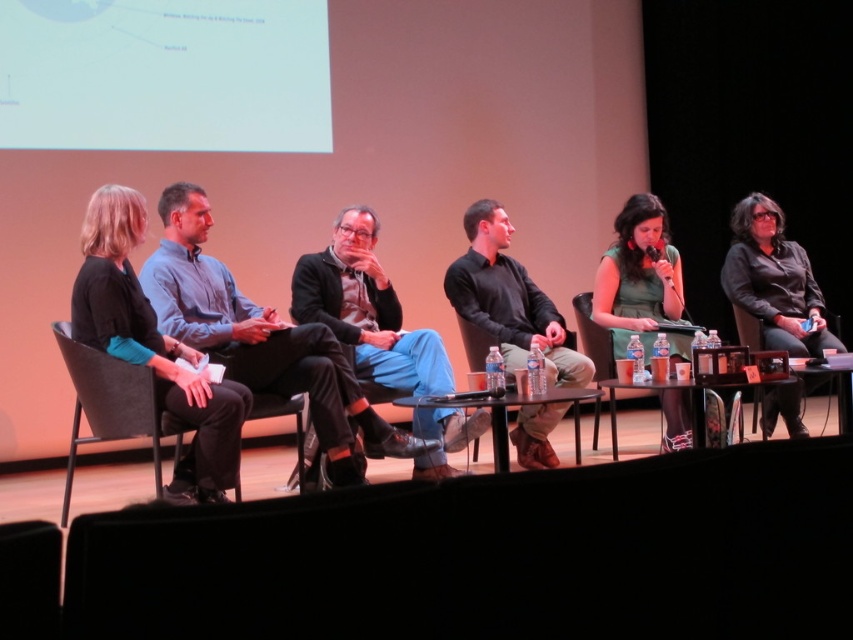
Question: Which of the following is the farthest from the observer?

Choices:
 (A) matte black jacket at center
 (B) blue shirt at center

Answer: (A)

Question: Does black fabric pants at left have a greater width compared to black leather chair at center?

Choices:
 (A) yes
 (B) no

Answer: (A)

Question: Which of the following is the closest to the observer?

Choices:
 (A) matte black jacket at center
 (B) black leather chair at right

Answer: (A)

Question: Can you confirm if black fabric pants at left is positioned above black leather chair at center?

Choices:
 (A) yes
 (B) no

Answer: (A)

Question: Which object is positioned farthest from the black leather chair at right?

Choices:
 (A) blue shirt at center
 (B) black leather chair at left
 (C) green matte dress at center

Answer: (B)

Question: Can you confirm if black fabric pants at left is positioned below black leather chair at left?

Choices:
 (A) no
 (B) yes

Answer: (A)